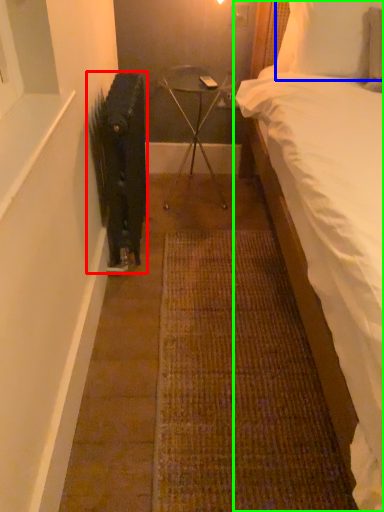
Question: Based on their relative distances, which object is farther from radiator (highlighted by a red box)? Choose from pillow (highlighted by a blue box) and bed (highlighted by a green box).

Choices:
 (A) pillow
 (B) bed

Answer: (A)